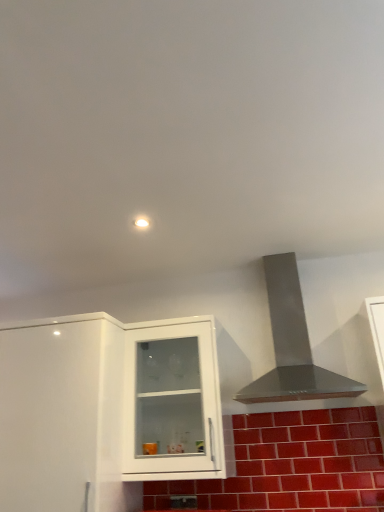
Question: From a real-world perspective, is white glossy cabinet at center, positioned as the second cabinetry in left-to-right order, under glossy ceramic brick at lower center?

Choices:
 (A) no
 (B) yes

Answer: (A)

Question: Does white glossy cabinet at center, positioned as the 1th cabinetry in right-to-left order, have a greater width compared to glossy ceramic brick at lower center?

Choices:
 (A) yes
 (B) no

Answer: (A)

Question: Does white glossy cabinet at center, positioned as the 1th cabinetry in right-to-left order, have a greater height compared to glossy ceramic brick at lower center?

Choices:
 (A) no
 (B) yes

Answer: (B)

Question: Could you tell me if white glossy cabinet at center, positioned as the 1th cabinetry in right-to-left order, is turned towards glossy ceramic brick at lower center?

Choices:
 (A) yes
 (B) no

Answer: (B)

Question: Considering the relative sizes of white glossy cabinet at center, positioned as the 1th cabinetry in right-to-left order, and glossy ceramic brick at lower center in the image provided, is white glossy cabinet at center, positioned as the 1th cabinetry in right-to-left order, thinner than glossy ceramic brick at lower center?

Choices:
 (A) yes
 (B) no

Answer: (B)

Question: Relative to glossy ceramic brick at lower center, is stainless steel vent at upper right in front or behind?

Choices:
 (A) front
 (B) behind

Answer: (A)

Question: Considering the positions of stainless steel vent at upper right and glossy ceramic brick at lower center in the image, is stainless steel vent at upper right taller or shorter than glossy ceramic brick at lower center?

Choices:
 (A) tall
 (B) short

Answer: (A)

Question: From a real-world perspective, is stainless steel vent at upper right positioned above or below glossy ceramic brick at lower center?

Choices:
 (A) above
 (B) below

Answer: (A)

Question: Based on their sizes in the image, would you say stainless steel vent at upper right is bigger or smaller than glossy ceramic brick at lower center?

Choices:
 (A) small
 (B) big

Answer: (B)

Question: Is point click(11, 395) positioned closer to the camera than point click(235, 509)?

Choices:
 (A) closer
 (B) farther

Answer: (A)

Question: From a real-world perspective, is white glossy cabinet at left, positioned as the first cabinetry in left-to-right order, above or below glossy ceramic brick at lower center?

Choices:
 (A) above
 (B) below

Answer: (A)

Question: In terms of width, does white glossy cabinet at left, which ranks as the 2th cabinetry in right-to-left order, look wider or thinner when compared to glossy ceramic brick at lower center?

Choices:
 (A) thin
 (B) wide

Answer: (B)

Question: In the image, is white glossy cabinet at left, which ranks as the 2th cabinetry in right-to-left order, positioned in front of or behind glossy ceramic brick at lower center?

Choices:
 (A) front
 (B) behind

Answer: (A)

Question: In terms of width, does glossy ceramic brick at lower center look wider or thinner when compared to stainless steel vent at upper right?

Choices:
 (A) wide
 (B) thin

Answer: (B)

Question: From the image's perspective, is glossy ceramic brick at lower center above or below stainless steel vent at upper right?

Choices:
 (A) below
 (B) above

Answer: (A)